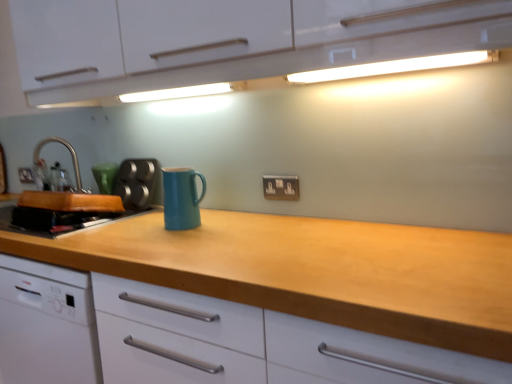
Find the location of a particular element. The width and height of the screenshot is (512, 384). free location in front of teal matte mug at center, which is the 1th kitchen appliance in front-to-back order is located at coordinates (183, 233).